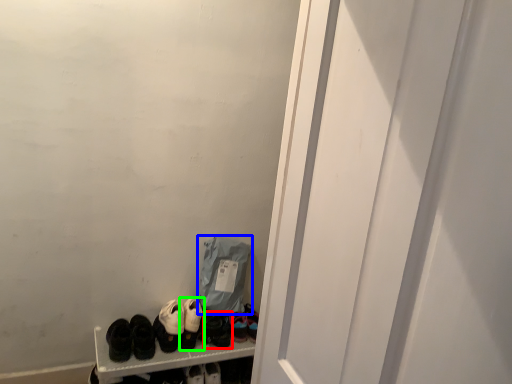
Question: Considering the real-world distances, which object is closest to footwear (highlighted by a red box)? bag (highlighted by a blue box) or footwear (highlighted by a green box).

Choices:
 (A) bag
 (B) footwear

Answer: (B)